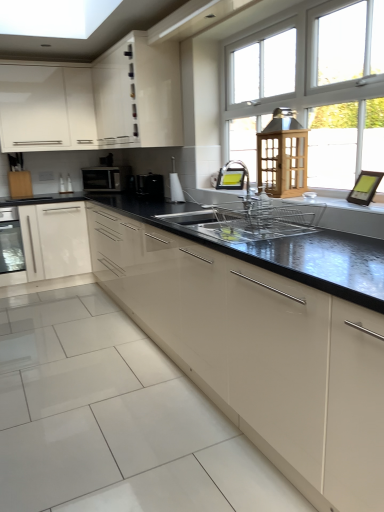
Question: From the image's perspective, is satin black microwave at upper left located above or below glossy cream cabinet at center, the 4th cabinetry viewed from the top?

Choices:
 (A) above
 (B) below

Answer: (A)

Question: Is satin black microwave at upper left inside the boundaries of glossy cream cabinet at center, which ranks as the 1th cabinetry in bottom-to-top order, or outside?

Choices:
 (A) outside
 (B) inside

Answer: (A)

Question: Which object is positioned farthest from the satin nickel faucet at center, which is the 2th faucet in back-to-front order?

Choices:
 (A) satin black microwave at upper left
 (B) white glossy cabinet at upper left, the 4th cabinetry when ordered from bottom to top
 (C) glossy cream cabinet at center, which ranks as the 1th cabinetry in bottom-to-top order
 (D) white glossy paper towel holder at center, placed as the first appliance when sorted from front to back
 (E) wooden cutting board at left, which is the third cabinetry from top to bottom

Answer: (E)

Question: Estimate the real-world distances between objects in this image. Which object is closer to the white glossy paper towel holder at center, placed as the first appliance when sorted from front to back?

Choices:
 (A) white glossy cabinet at upper center, the 2th cabinetry when ordered from top to bottom
 (B) satin nickel faucet at center, positioned as the first faucet in front-to-back order
 (C) satin nickel faucet at center, placed as the 2th faucet when sorted from front to back
 (D) glossy cream cabinet at center, the 4th cabinetry viewed from the top
 (E) wooden cutting board at left, arranged as the 2th cabinetry when ordered from the bottom

Answer: (B)